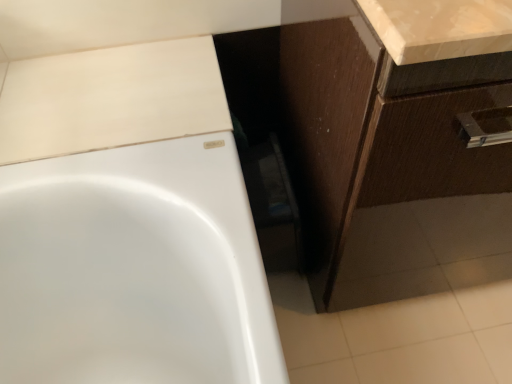
This screenshot has height=384, width=512. What are the coordinates of `dark wood cabinet at right` in the screenshot? It's located at (400, 115).

Describe the element at coordinates (400, 115) in the screenshot. I see `dark wood cabinet at right` at that location.

This screenshot has height=384, width=512. I want to click on dark wood cabinet at right, so [x=400, y=115].